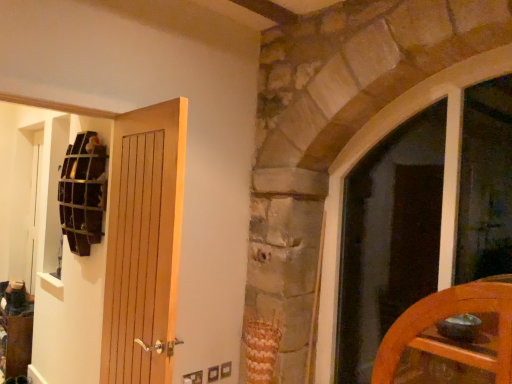
Question: Considering the relative positions of matte glass window at right and wooden grid at upper left in the image provided, is matte glass window at right to the left of wooden grid at upper left from the viewer's perspective?

Choices:
 (A) yes
 (B) no

Answer: (B)

Question: Is matte glass window at right bigger than wooden grid at upper left?

Choices:
 (A) yes
 (B) no

Answer: (A)

Question: Considering the relative sizes of matte glass window at right and wooden grid at upper left in the image provided, is matte glass window at right wider than wooden grid at upper left?

Choices:
 (A) no
 (B) yes

Answer: (B)

Question: Is matte glass window at right shorter than wooden grid at upper left?

Choices:
 (A) yes
 (B) no

Answer: (B)

Question: From a real-world perspective, is matte glass window at right positioned under wooden grid at upper left based on gravity?

Choices:
 (A) no
 (B) yes

Answer: (B)

Question: Is matte glass window at right oriented towards wooden grid at upper left?

Choices:
 (A) yes
 (B) no

Answer: (B)

Question: From the image's perspective, is wooden grid at upper left under matte glass window at right?

Choices:
 (A) no
 (B) yes

Answer: (A)

Question: Is wooden grid at upper left outside of matte glass window at right?

Choices:
 (A) yes
 (B) no

Answer: (A)

Question: Is wooden grid at upper left smaller than matte glass window at right?

Choices:
 (A) no
 (B) yes

Answer: (B)

Question: Considering the relative sizes of wooden grid at upper left and matte glass window at right in the image provided, is wooden grid at upper left wider than matte glass window at right?

Choices:
 (A) no
 (B) yes

Answer: (A)

Question: Does wooden grid at upper left have a greater height compared to matte glass window at right?

Choices:
 (A) no
 (B) yes

Answer: (A)

Question: Does wooden grid at upper left come in front of matte glass window at right?

Choices:
 (A) yes
 (B) no

Answer: (B)

Question: Is matte glass window at right thinner than wooden door at left, positioned as the first door in left-to-right order?

Choices:
 (A) no
 (B) yes

Answer: (A)